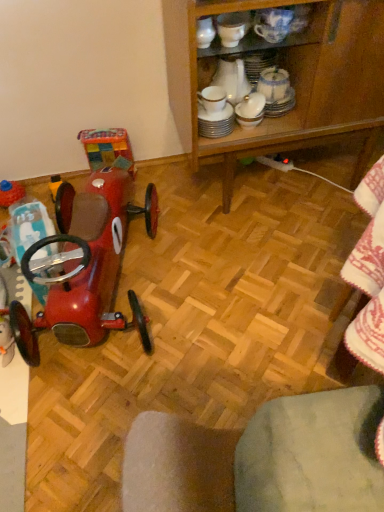
Where is `vacant area that lies between wooden cabinet at center and shiny red car at left, which is the 1th toy in right-to-left order`? vacant area that lies between wooden cabinet at center and shiny red car at left, which is the 1th toy in right-to-left order is located at coordinates (234, 247).